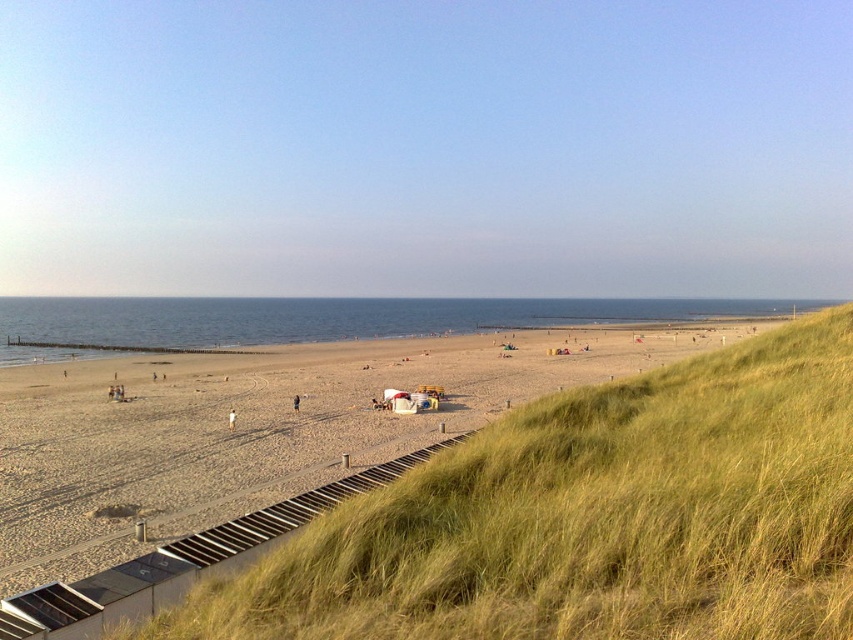
You are planning to build a small sandcastle on the beach. Based on the image, which area would you choose between the beige sand beach at center and the light brown sand at center to ensure it has enough space?

The beige sand beach at center is wider than the light brown sand at center, so you should choose the beige sand beach at center for building the sandcastle to have enough space.

You are standing on the wooden walkway and want to walk to the light brown sand at center. Which direction should you go relative to the beige sand beach at center?

The beige sand beach at center is closer to the viewer than the light brown sand at center, so you should walk away from the beige sand beach at center towards the light brown sand at center.